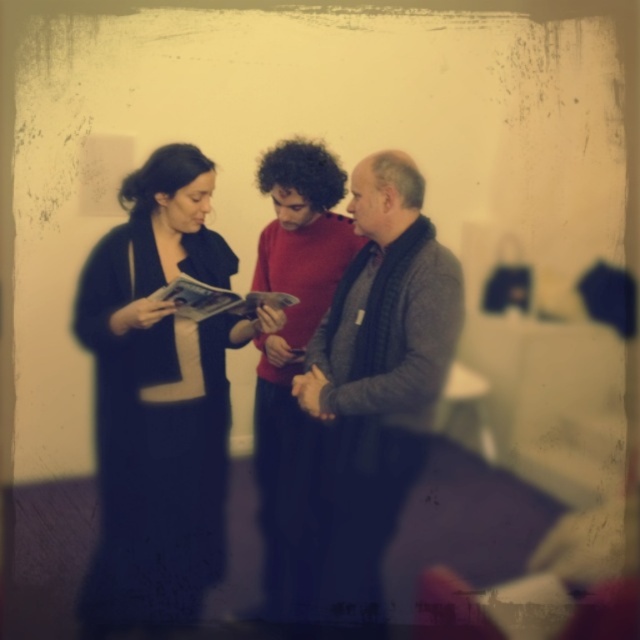
Question: Is dark blue dress at center further to camera compared to red sweater at center?

Choices:
 (A) no
 (B) yes

Answer: (A)

Question: Estimate the real-world distances between objects in this image. Which object is farther from the gray sweater at center?

Choices:
 (A) red sweater at center
 (B) dark blue dress at center

Answer: (B)

Question: Does gray sweater at center lie behind red sweater at center?

Choices:
 (A) no
 (B) yes

Answer: (A)

Question: Based on their relative distances, which object is farther from the dark blue dress at center?

Choices:
 (A) red sweater at center
 (B) gray sweater at center

Answer: (B)

Question: Can you confirm if dark blue dress at center is positioned above red sweater at center?

Choices:
 (A) no
 (B) yes

Answer: (A)

Question: Which object appears farthest from the camera in this image?

Choices:
 (A) red sweater at center
 (B) dark blue dress at center

Answer: (A)